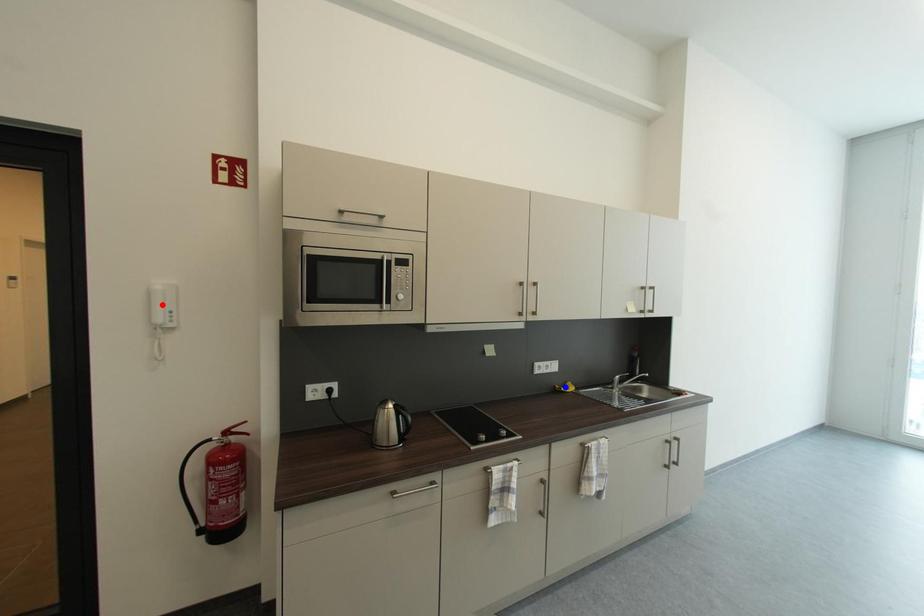
Question: Which of the two points in the image is closer to the camera?

Choices:
 (A) Blue point is closer.
 (B) Red point is closer.

Answer: (B)